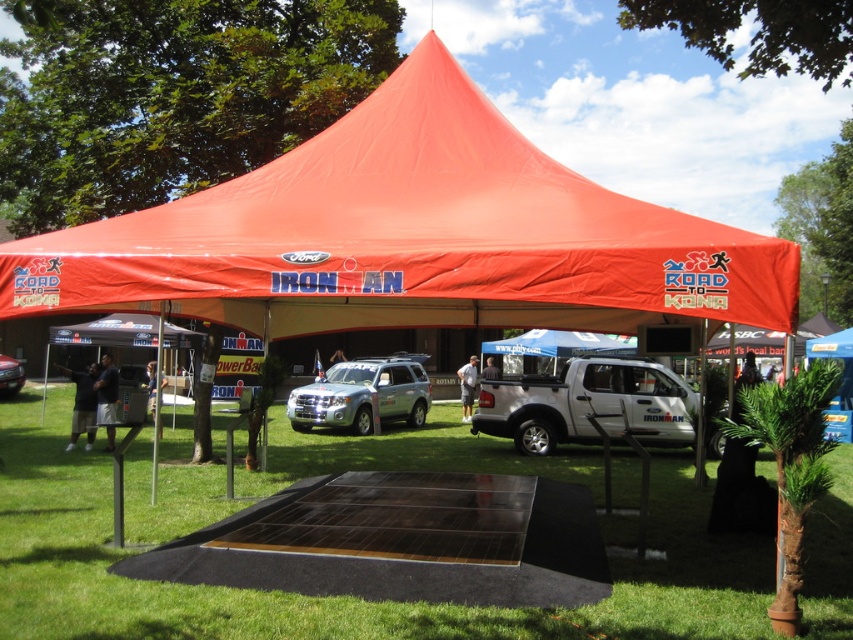
Question: From the image, what is the correct spatial relationship of green grass at lower center in relation to silver metallic suv at center?

Choices:
 (A) left
 (B) right

Answer: (B)

Question: Can you confirm if silver metallic suv at center is smaller than metallic silver suv at center?

Choices:
 (A) yes
 (B) no

Answer: (B)

Question: Which of these objects is positioned closest to the metallic silver suv at center?

Choices:
 (A) silver metallic suv at center
 (B) green grass at lower center

Answer: (A)

Question: Which point is closer to the camera?

Choices:
 (A) metallic silver suv at center
 (B) green grass at lower center

Answer: (B)

Question: Does white matte truck at center have a lesser width compared to metallic silver suv at center?

Choices:
 (A) yes
 (B) no

Answer: (B)

Question: Among these points, which one is farthest from the camera?

Choices:
 (A) (399, 412)
 (B) (585, 416)
 (C) (587, 456)

Answer: (A)